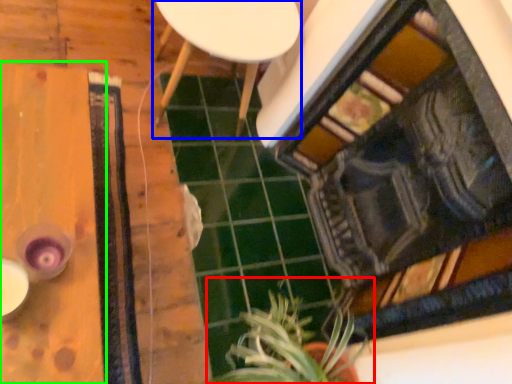
Question: Which object is positioned farthest from houseplant (highlighted by a red box)? Select from furniture (highlighted by a blue box) and table (highlighted by a green box).

Choices:
 (A) furniture
 (B) table

Answer: (A)